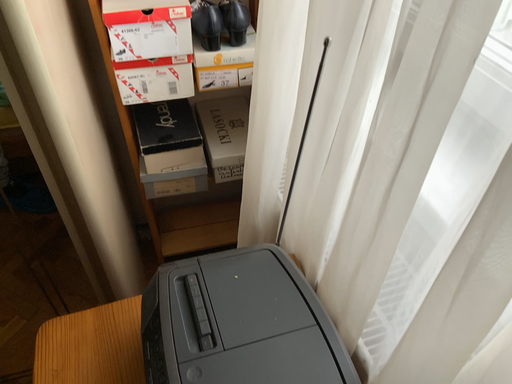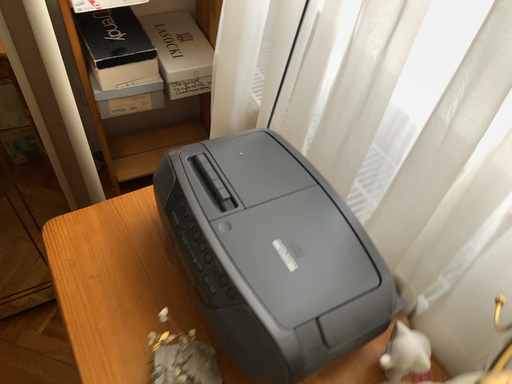
Question: How did the camera likely rotate when shooting the video?

Choices:
 (A) rotated left
 (B) rotated right

Answer: (B)